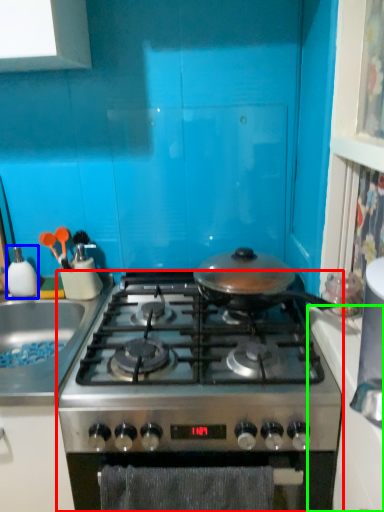
Question: Estimate the real-world distances between objects in this image. Which object is closer to gas stove (highlighted by a red box), kitchen appliance (highlighted by a blue box) or counter top (highlighted by a green box)?

Choices:
 (A) kitchen appliance
 (B) counter top

Answer: (B)